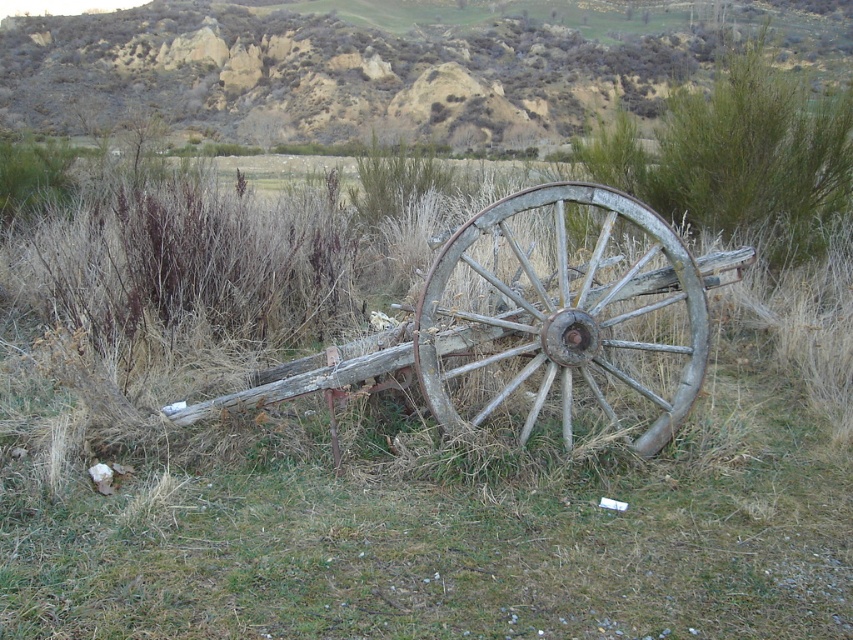
Can you confirm if brown textured hillside at upper center is bigger than weathered wood cart at center?

Indeed, brown textured hillside at upper center has a larger size compared to weathered wood cart at center.

Can you confirm if brown textured hillside at upper center is smaller than weathered wood cart at center?

Incorrect, brown textured hillside at upper center is not smaller in size than weathered wood cart at center.

Who is more forward, (788,61) or (670,272)?

Point (670,272) is in front.

Where is `brown textured hillside at upper center`? The height and width of the screenshot is (640, 853). brown textured hillside at upper center is located at coordinates (392, 61).

Does brown textured hillside at upper center have a larger size compared to weathered wood wagon wheel at center?

Indeed, brown textured hillside at upper center has a larger size compared to weathered wood wagon wheel at center.

In the scene shown: Measure the distance between brown textured hillside at upper center and camera.

A distance of 18.23 meters exists between brown textured hillside at upper center and camera.

Identify the location of brown textured hillside at upper center. (392, 61).

Does weathered wood cart at center have a lesser width compared to weathered wood wagon wheel at center?

No.

Which is in front, point (515, 387) or point (553, 236)?

Positioned in front is point (515, 387).

You are a GUI agent. You are given a task and a screenshot of the screen. Output one action in this format:
    pyautogui.click(x=<x>, y=<y>)
    Task: Click on the weathered wood cart at center
    The width and height of the screenshot is (853, 640).
    Given the screenshot: What is the action you would take?
    pyautogui.click(x=535, y=324)